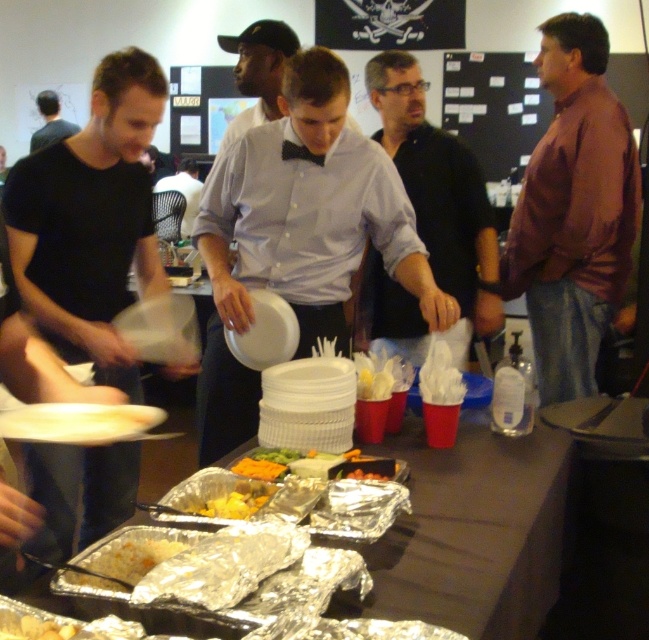
Question: Which object appears farthest from the camera in this image?

Choices:
 (A) shiny aluminum foil at center
 (B) yellow crumbly food at center
 (C) orange matte food at center

Answer: (C)

Question: Estimate the real-world distances between objects in this image. Which object is closer to the smooth black shirt at center?

Choices:
 (A) yellow crumbly cheese at lower left
 (B) green leafy vegetables at center
 (C) yellowish plastic tray at center
 (D) aluminum foil trays at center

Answer: (D)

Question: Is black matte shirt at center smaller than orange matte food at center?

Choices:
 (A) yes
 (B) no

Answer: (B)

Question: Does matte white plate at center have a smaller size compared to dark brown hair at upper left?

Choices:
 (A) no
 (B) yes

Answer: (A)

Question: Can you confirm if white matte plate at lower left is positioned to the right of shiny aluminum foil at center?

Choices:
 (A) yes
 (B) no

Answer: (B)

Question: Which of the following is the farthest from the observer?

Choices:
 (A) (591, 145)
 (B) (332, 301)
 (C) (31, 150)
 (D) (195, 164)

Answer: (C)